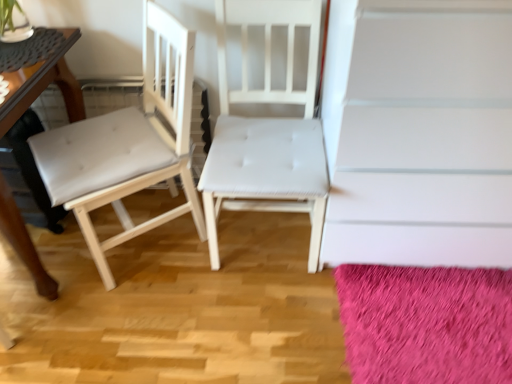
Question: Is white matte stairwell at upper center inside the boundaries of wooden table at left, or outside?

Choices:
 (A) inside
 (B) outside

Answer: (B)

Question: Is white matte stairwell at upper center to the left or to the right of wooden table at left in the image?

Choices:
 (A) right
 (B) left

Answer: (A)

Question: Considering the real-world distances, which object is farthest from the white matte stairwell at upper center?

Choices:
 (A) white leather chair at left, which is counted as the 1th chair, starting from the left
 (B) fuzzy pink rug at lower right
 (C) white fabric chair at center, placed as the second chair when sorted from left to right
 (D) wooden table at left

Answer: (D)

Question: Which object is the farthest from the fuzzy pink rug at lower right?

Choices:
 (A) white fabric chair at center, which is the first chair from right to left
 (B) white matte stairwell at upper center
 (C) wooden table at left
 (D) white leather chair at left, which ranks as the second chair in right-to-left order

Answer: (C)